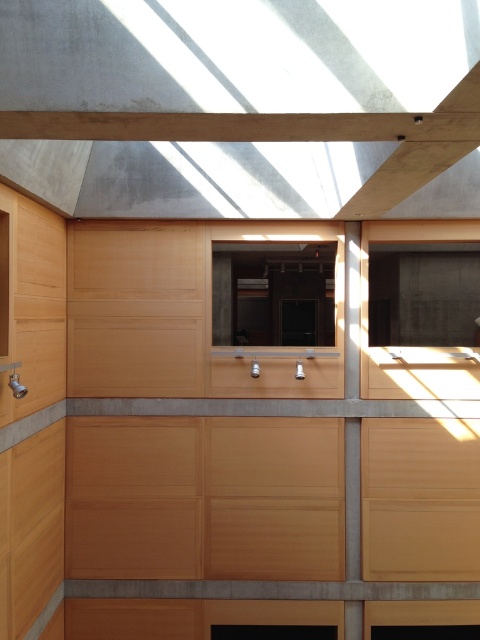
Is transparent glass window at center positioned behind matte wood window at center?

Yes.

Which is more to the right, transparent glass window at center or matte wood window at center?

From the viewer's perspective, matte wood window at center appears more on the right side.

Is point (290, 312) farther from camera compared to point (458, 387)?

Yes, point (290, 312) is behind point (458, 387).

You are a GUI agent. You are given a task and a screenshot of the screen. Output one action in this format:
    pyautogui.click(x=<x>, y=<y>)
    Task: Click on the transparent glass window at center
    The width and height of the screenshot is (480, 640).
    Given the screenshot: What is the action you would take?
    pyautogui.click(x=273, y=294)